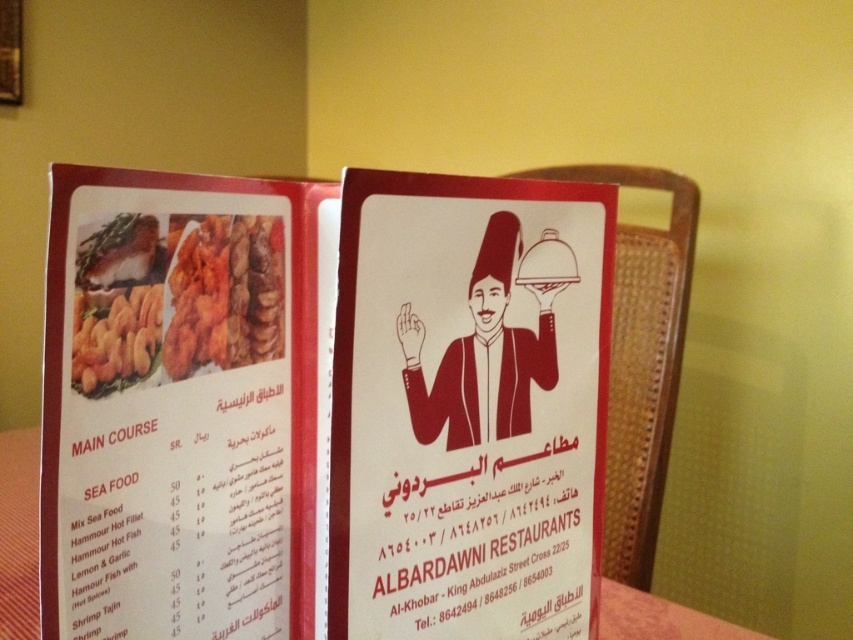
Question: Which object is positioned closest to the golden crispy fish at upper left?

Choices:
 (A) golden crispy shrimp at center
 (B) brown paper-like material waiter at center
 (C) matte paper menu at center
 (D) wooden table at center

Answer: (A)

Question: Which point appears closest to the camera in this image?

Choices:
 (A) (149, 225)
 (B) (511, 241)
 (C) (161, 339)
 (D) (218, 300)

Answer: (A)

Question: Estimate the real-world distances between objects in this image. Which object is farther from the golden crispy shrimp at center?

Choices:
 (A) brown paper-like material waiter at center
 (B) matte red menu at center
 (C) wooden table at center
 (D) golden fried chicken at center

Answer: (C)

Question: Does matte red menu at center have a smaller size compared to golden crispy shrimp at center?

Choices:
 (A) no
 (B) yes

Answer: (A)

Question: Is brown paper-like material waiter at center to the left of golden crispy shrimp at center from the viewer's perspective?

Choices:
 (A) yes
 (B) no

Answer: (B)

Question: Does wooden table at center appear over golden crispy shrimp at center?

Choices:
 (A) no
 (B) yes

Answer: (A)